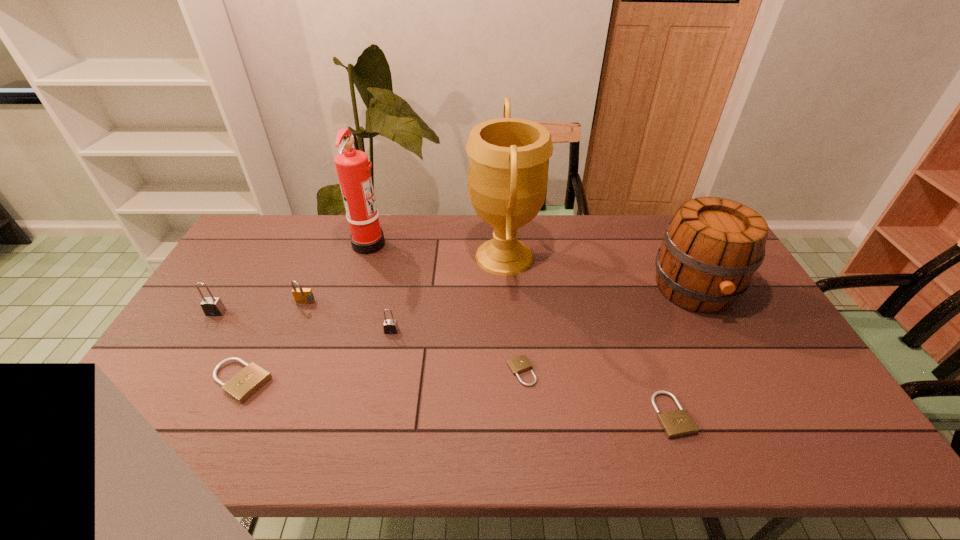
This screenshot has width=960, height=540. Find the location of `object at the right edge`. object at the right edge is located at coordinates (711, 248).

The image size is (960, 540). Identify the location of free spot at the far edge of the desktop. (657, 221).

In the image, there is a desktop. In order to click on vacant space at the near edge in this screenshot , I will do `click(634, 432)`.

Locate an element on the screen. This screenshot has width=960, height=540. free space at the left edge is located at coordinates (156, 414).

Locate an element on the screen. This screenshot has width=960, height=540. vacant space at the near left corner of the desktop is located at coordinates (116, 424).

You are a GUI agent. You are given a task and a screenshot of the screen. Output one action in this format:
    pyautogui.click(x=<x>, y=<y>)
    Task: Click on the free space between the farthest padlock and the smallest beige padlock
    The height and width of the screenshot is (540, 960).
    Given the screenshot: What is the action you would take?
    pyautogui.click(x=414, y=338)

You are a GUI agent. You are given a task and a screenshot of the screen. Output one action in this format:
    pyautogui.click(x=<x>, y=<y>)
    Task: Click on the free spot between the trophy and the farthest padlock
    
    Given the screenshot: What is the action you would take?
    pyautogui.click(x=405, y=280)

Image resolution: width=960 pixels, height=540 pixels. What are the coordinates of `empty location between the fifth padlock from left to right and the eighth object from left to right` in the screenshot? It's located at (597, 393).

The height and width of the screenshot is (540, 960). Find the location of `free space between the third shortest object and the third tallest object`. free space between the third shortest object and the third tallest object is located at coordinates (468, 335).

Locate an element on the screen. Image resolution: width=960 pixels, height=540 pixels. blank region between the fifth object from left to right and the rightmost object is located at coordinates (543, 310).